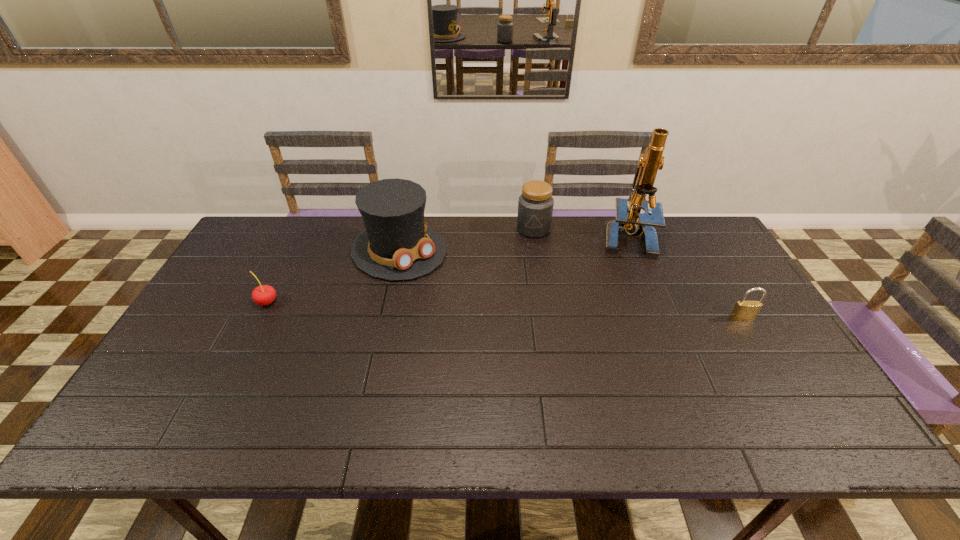
I want to click on free spot located at the eyepiece of the microscope, so point(612,263).

The width and height of the screenshot is (960, 540). In order to click on jar situated at the far edge in this screenshot , I will do `click(535, 205)`.

Identify the location of dress hat positioned at the far edge. (397, 244).

Where is `microscope present at the far edge`? microscope present at the far edge is located at coordinates (629, 220).

Where is `object at the left edge`? The image size is (960, 540). object at the left edge is located at coordinates (262, 295).

The height and width of the screenshot is (540, 960). What are the coordinates of `object at the right edge` in the screenshot? It's located at (743, 310).

Locate an element on the screen. This screenshot has width=960, height=540. free spot at the far edge of the desktop is located at coordinates (474, 237).

The image size is (960, 540). In the image, there is a desktop. Find the location of `vacant space at the near edge`. vacant space at the near edge is located at coordinates (329, 396).

Locate an element on the screen. The height and width of the screenshot is (540, 960). blank space at the left edge is located at coordinates (250, 269).

This screenshot has width=960, height=540. In the image, there is a desktop. Find the location of `free space at the far left corner`. free space at the far left corner is located at coordinates (263, 255).